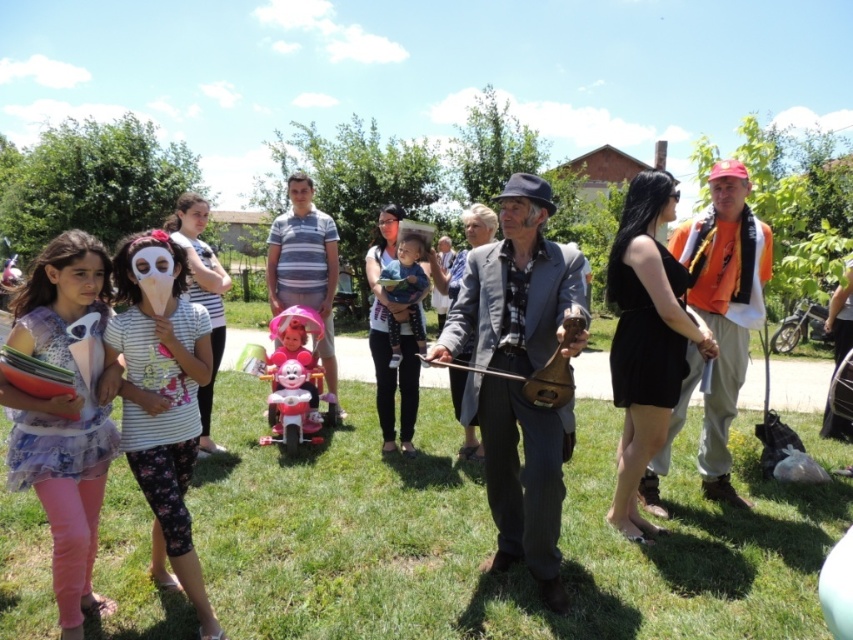
Can you confirm if orange fabric shirt at right is smaller than striped cotton shirt at center?

No, orange fabric shirt at right is not smaller than striped cotton shirt at center.

Does point (711, 289) lie behind point (279, 253)?

No, it is in front of (279, 253).

The width and height of the screenshot is (853, 640). I want to click on orange fabric shirt at right, so click(x=724, y=305).

Can you confirm if matte gray suit at center is taller than orange fabric shirt at right?

In fact, matte gray suit at center may be shorter than orange fabric shirt at right.

Who is taller, matte gray suit at center or orange fabric shirt at right?

orange fabric shirt at right is taller.

Which is behind, point (503, 204) or point (738, 170)?

The point (738, 170) is behind.

At what (x,y) coordinates should I click in order to perform the action: click on matte gray suit at center. Please return your answer as a coordinate pair (x, y). Looking at the image, I should click on (517, 289).

Can you confirm if green grass at center is wider than pink plastic toy at center?

Indeed, green grass at center has a greater width compared to pink plastic toy at center.

Is green grass at center behind pink plastic toy at center?

No, it is not.

Consider the image. Who is more forward, (590,532) or (289,419)?

Point (590,532) is more forward.

This screenshot has width=853, height=640. What are the coordinates of `green grass at center` in the screenshot? It's located at (490, 538).